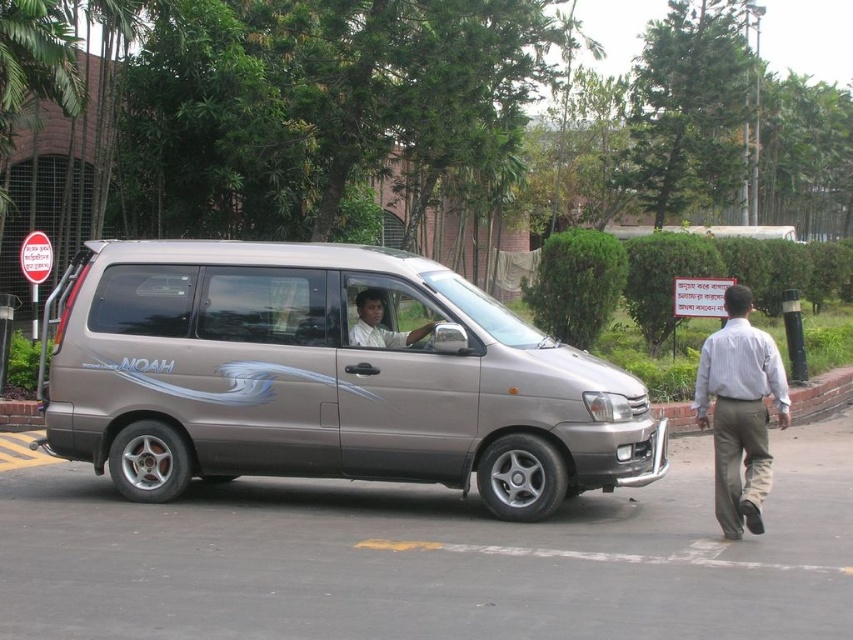
Where is the satin metallic van at center located in the image?

The satin metallic van at center is located at point (326, 378) in the image.

You are a delivery person who needs to load a package into the back of the satin metallic van at center. The package is 1.8 meters tall. Considering the height of the van and the light brown shirt at center, can the package fit vertically inside the van?

The satin metallic van at center is taller than the light brown shirt at center. However, the height of the light brown shirt at center alone cannot determine the van height. The package may or may not fit. More information is needed about the van height.

You are standing at the point marked as point (703, 420) in the parking lot. You want to walk to the point marked as point (346, 404). Which direction should you face to walk straight towards your destination?

To walk straight towards point (346, 404) from point (703, 420), you should face the direction that is diagonally downward and to the left, as point (346, 404) is located behind point (703, 420).